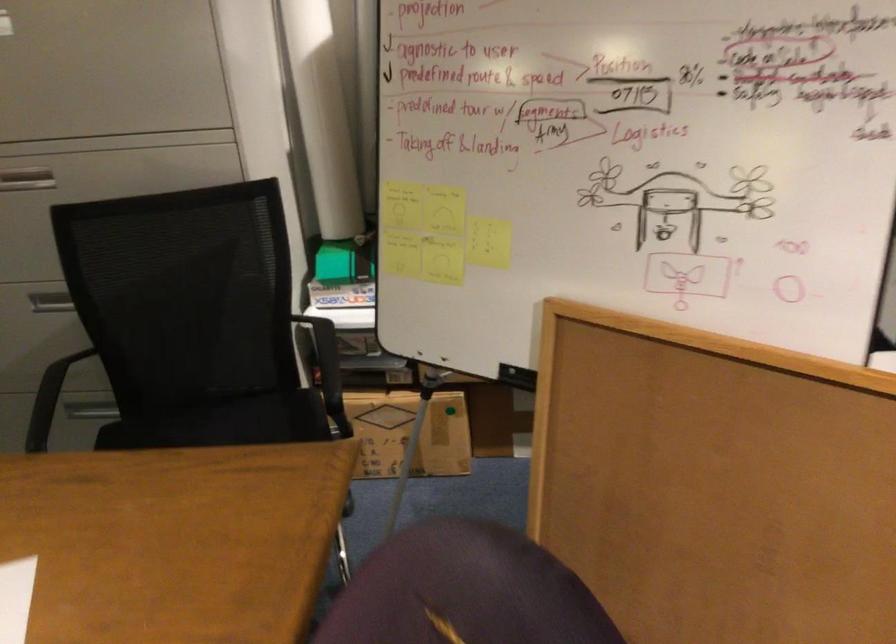
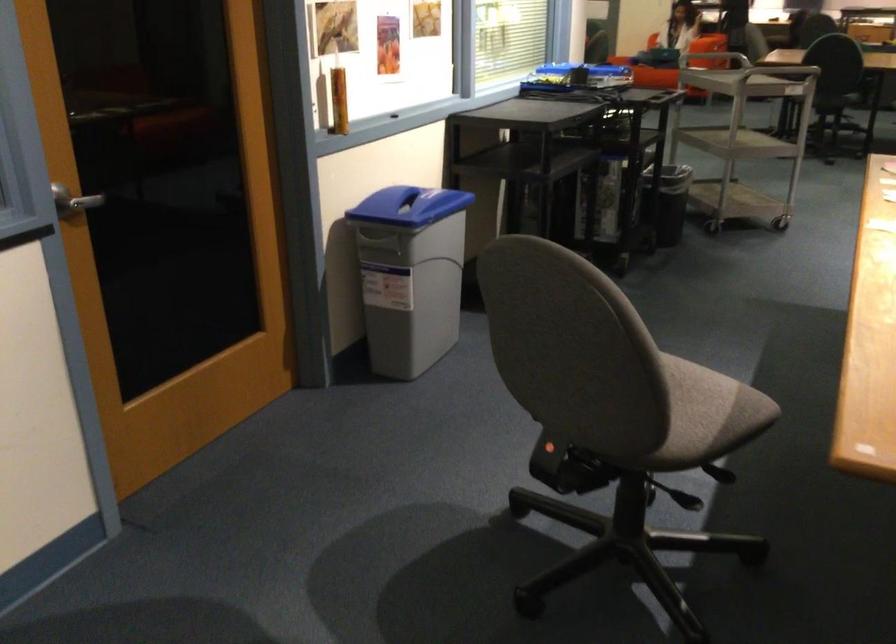
The first image is from the beginning of the video and the second image is from the end. How did the camera likely rotate when shooting the video?

The rotation direction of the camera is left-down.